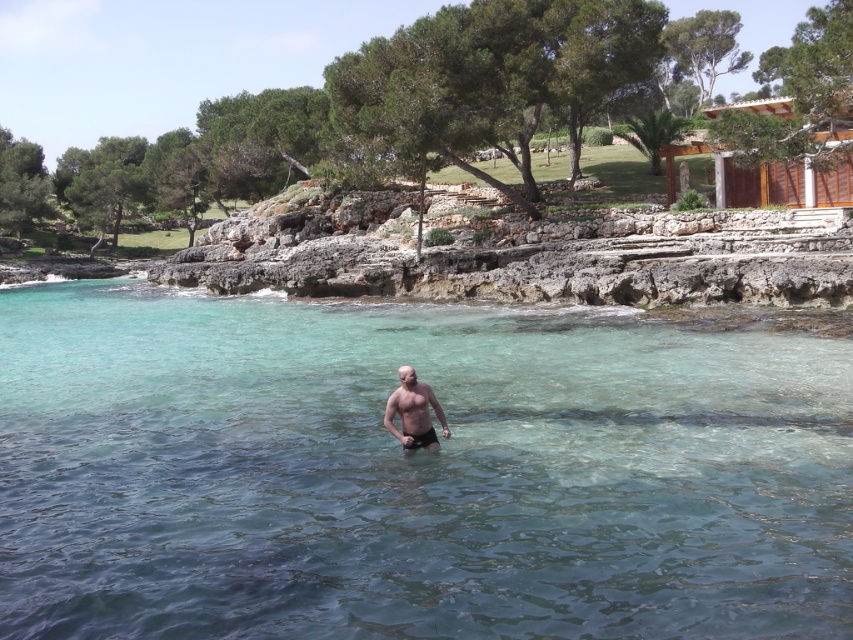
Question: Observing the image, what is the correct spatial positioning of clear water at center in reference to smooth skin man at center?

Choices:
 (A) below
 (B) above

Answer: (B)

Question: Is clear water at center behind smooth skin man at center?

Choices:
 (A) no
 (B) yes

Answer: (A)

Question: Which object appears farthest from the camera in this image?

Choices:
 (A) smooth skin man at center
 (B) clear water at center

Answer: (A)

Question: Is clear water at center below smooth skin man at center?

Choices:
 (A) yes
 (B) no

Answer: (B)

Question: Which point is farther to the camera?

Choices:
 (A) clear water at center
 (B) smooth skin man at center

Answer: (B)